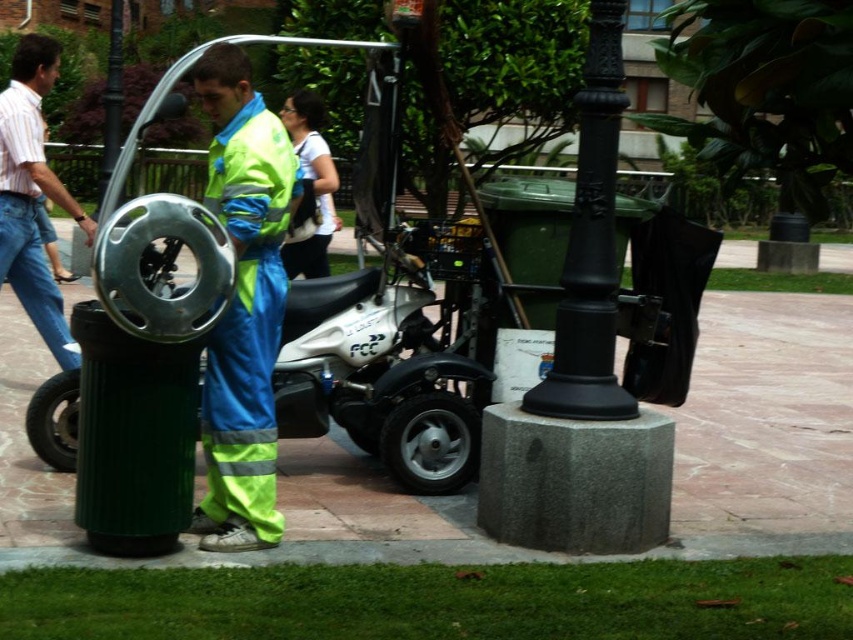
Is striped cotton shirt at left below black rubber tire at lower left?

Incorrect, striped cotton shirt at left is not positioned below black rubber tire at lower left.

Does striped cotton shirt at left appear over black rubber tire at lower left?

Yes, striped cotton shirt at left is above black rubber tire at lower left.

Where is `striped cotton shirt at left`? striped cotton shirt at left is located at coordinates (32, 195).

Can you confirm if white matte motorcycle at center is wider than striped cotton shirt at left?

Correct, the width of white matte motorcycle at center exceeds that of striped cotton shirt at left.

At what (x,y) coordinates should I click in order to perform the action: click on white matte motorcycle at center. Please return your answer as a coordinate pair (x, y). The height and width of the screenshot is (640, 853). Looking at the image, I should click on (381, 371).

Between white matte motorcycle at center and black rubber tire at lower left, which one is positioned lower?

black rubber tire at lower left is below.

In the scene shown: Can you confirm if white matte motorcycle at center is thinner than black rubber tire at lower left?

In fact, white matte motorcycle at center might be wider than black rubber tire at lower left.

At what (x,y) coordinates should I click in order to perform the action: click on white matte motorcycle at center. Please return your answer as a coordinate pair (x, y). This screenshot has height=640, width=853. Looking at the image, I should click on (381, 371).

Where is `white matte motorcycle at center`? This screenshot has height=640, width=853. white matte motorcycle at center is located at coordinates (381, 371).